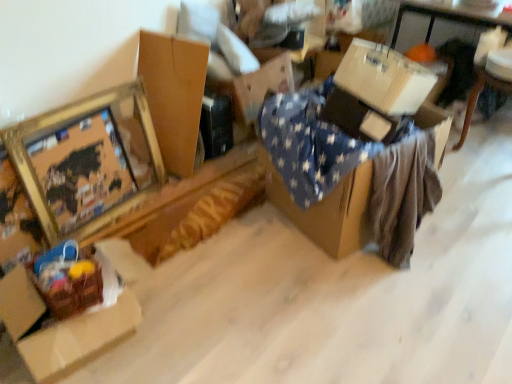
The image size is (512, 384). Find the location of `vacant space situated on the left part of blue star-patterned fabric at center, acting as the 2th table starting from the right`. vacant space situated on the left part of blue star-patterned fabric at center, acting as the 2th table starting from the right is located at coordinates (248, 250).